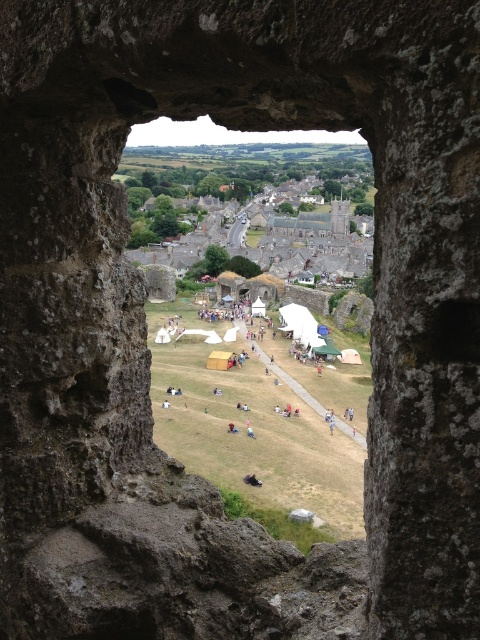
Based on the photo, is white canvas tents at center wider than blue fabric person at center?

Yes, white canvas tents at center is wider than blue fabric person at center.

Between point (252, 346) and point (252, 429), which one is positioned in front?

Point (252, 429) is more forward.

Find the location of a particular element. This screenshot has width=480, height=640. white canvas tents at center is located at coordinates (277, 369).

Can you confirm if blue fabric person at center is bigger than light blue fabric person at center?

Incorrect, blue fabric person at center is not larger than light blue fabric person at center.

Between blue fabric person at center and light blue fabric person at center, which one is positioned higher?

light blue fabric person at center

Does point (252, 432) come closer to viewer compared to point (162, 404)?

Yes.

Identify the location of blue fabric person at center. (250, 433).

Which is more to the left, white canvas tents at center or light blue fabric person at center?

light blue fabric person at center

Who is shorter, white canvas tents at center or light blue fabric person at center?

With less height is light blue fabric person at center.

Who is more forward, (163,333) or (162,406)?

Point (162,406)

The width and height of the screenshot is (480, 640). In order to click on white canvas tents at center in this screenshot , I will do `click(277, 369)`.